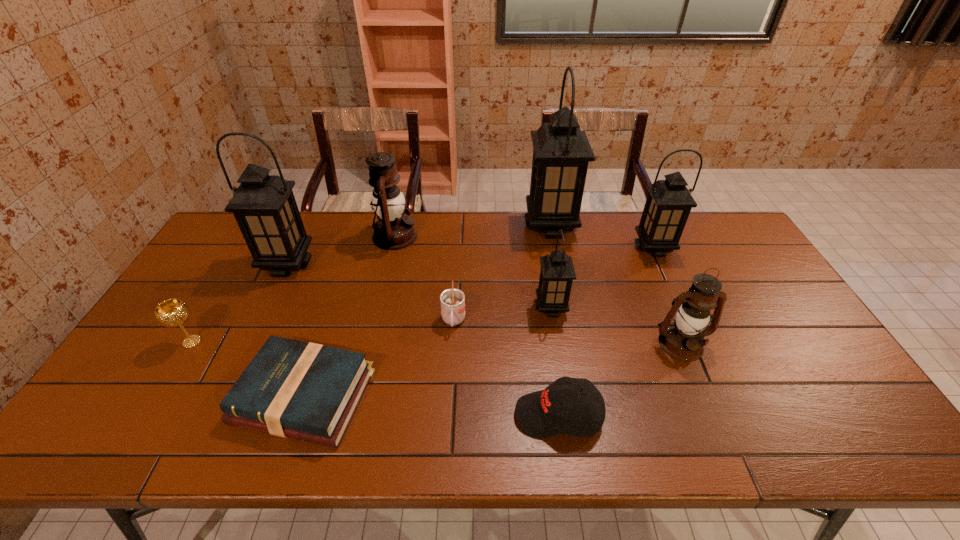
Point out which black lantern is positioned as the second nearest to the black baseball cap. Please provide its 2D coordinates. Your answer should be formatted as a tuple, i.e. [(x, y)], where the tuple contains the x and y coordinates of a point satisfying the conditions above.

[(669, 202)]

Point out which black lantern is positioned as the fourth nearest to the second lantern from left to right. Please provide its 2D coordinates. Your answer should be formatted as a tuple, i.e. [(x, y)], where the tuple contains the x and y coordinates of a point satisfying the conditions above.

[(669, 202)]

Locate an element on the screen. This screenshot has width=960, height=540. vacant area in the image that satisfies the following two spatial constraints: 1. on the back side of the smallest black lantern; 2. on the right side of the second smallest black lantern is located at coordinates (541, 248).

At what (x,y) coordinates should I click in order to perform the action: click on free space that satisfies the following two spatial constraints: 1. on the front side of the biggest black lantern; 2. on the front-facing side of the baseball cap. Please return your answer as a coordinate pair (x, y). This screenshot has width=960, height=540. Looking at the image, I should click on (588, 415).